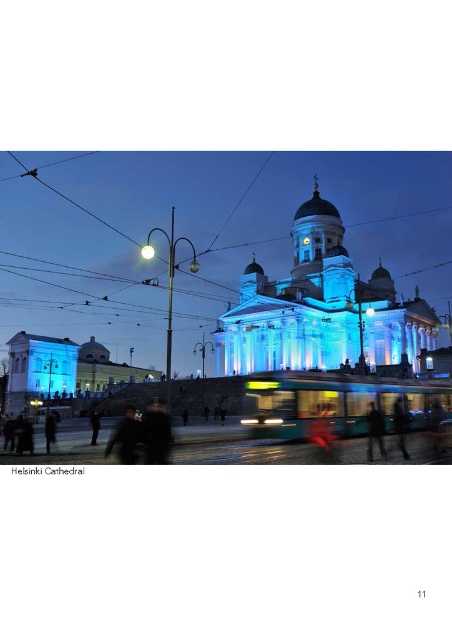
Is illuminated stone cathedral at center behind light blue stone church at center?

No.

Who is lower down, illuminated stone cathedral at center or light blue stone church at center?

Positioned lower is illuminated stone cathedral at center.

Which is in front, point (145, 340) or point (381, 316)?

Point (381, 316)

I want to click on illuminated stone cathedral at center, so click(x=212, y=244).

Between light blue stone church at center and dark fabric jacket at center, which one has more height?

light blue stone church at center is taller.

Is point (299, 228) positioned after point (380, 442)?

Yes, it is.

You are a GUI agent. You are given a task and a screenshot of the screen. Output one action in this format:
    pyautogui.click(x=<x>, y=<y>)
    Task: Click on the light blue stone church at center
    The height and width of the screenshot is (640, 452).
    Given the screenshot: What is the action you would take?
    pos(320,308)

Is illuminated stone cathedral at center positioned behind dark fabric jacket at center?

Yes, it is.

Between illuminated stone cathedral at center and dark fabric jacket at center, which one is positioned lower?

dark fabric jacket at center is below.

At what (x,y) coordinates should I click in order to perform the action: click on illuminated stone cathedral at center. Please return your answer as a coordinate pair (x, y). Image resolution: width=452 pixels, height=640 pixels. Looking at the image, I should click on (212, 244).